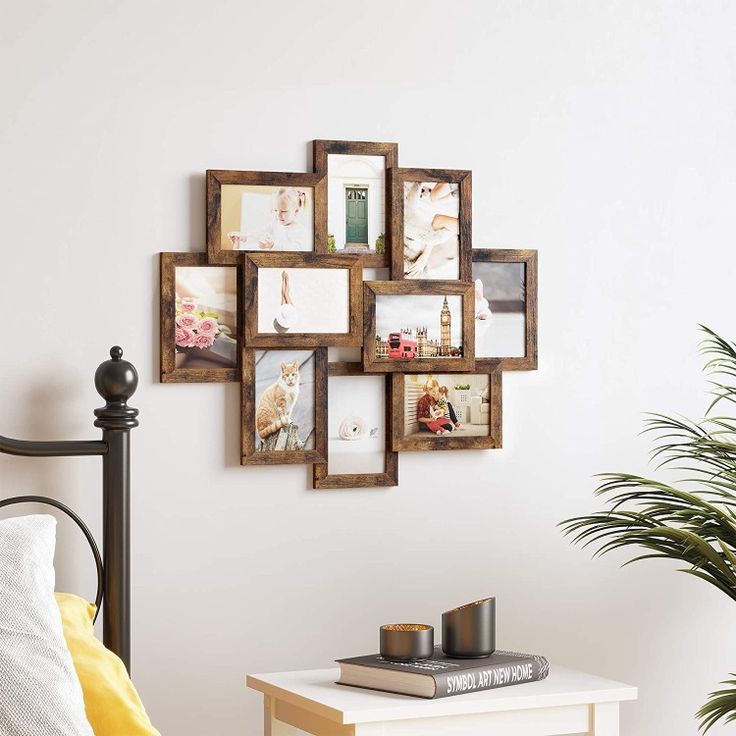
The image size is (736, 736). I want to click on frames, so click(378, 489), click(492, 442), click(526, 364), click(442, 358), click(461, 201), click(266, 184), click(321, 261), click(250, 403), click(174, 375), click(357, 155).